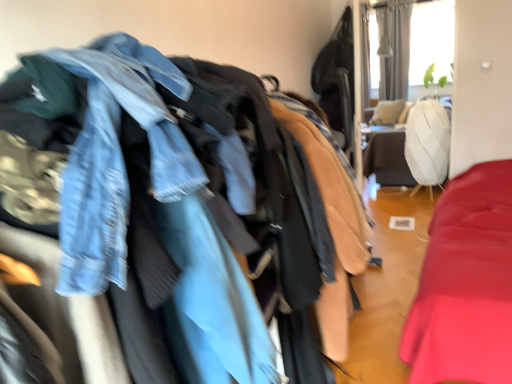
Identify the location of white textured curtain at upper right. Image resolution: width=512 pixels, height=384 pixels. [393, 48].

What do you see at coordinates (393, 48) in the screenshot? The width and height of the screenshot is (512, 384). I see `white textured curtain at upper right` at bounding box center [393, 48].

What do you see at coordinates (168, 207) in the screenshot? Image resolution: width=512 pixels, height=384 pixels. I see `faded denim jacket at upper left` at bounding box center [168, 207].

At what (x,y) coordinates should I click in order to perform the action: click on faded denim jacket at upper left. Please return your answer as a coordinate pair (x, y). Image resolution: width=512 pixels, height=384 pixels. Looking at the image, I should click on (168, 207).

What are the coordinates of `white textured curtain at upper right` in the screenshot? It's located at (393, 48).

Considering the relative positions of faded denim jacket at upper left and white textured curtain at upper right in the image provided, is faded denim jacket at upper left to the left or to the right of white textured curtain at upper right?

Based on their positions, faded denim jacket at upper left is located to the left of white textured curtain at upper right.

Between faded denim jacket at upper left and white textured curtain at upper right, which one is positioned behind?

white textured curtain at upper right is further from the camera.

Is point (275, 379) closer to viewer compared to point (400, 42)?

Yes.

From the image's perspective, who appears lower, faded denim jacket at upper left or white textured curtain at upper right?

faded denim jacket at upper left.

From a real-world perspective, between faded denim jacket at upper left and white textured curtain at upper right, who is vertically lower?

faded denim jacket at upper left is physically lower.

Is faded denim jacket at upper left wider or thinner than white textured curtain at upper right?

In the image, faded denim jacket at upper left appears to be wider than white textured curtain at upper right.

Between faded denim jacket at upper left and white textured curtain at upper right, which one has more height?

white textured curtain at upper right.

Can you confirm if faded denim jacket at upper left is bigger than white textured curtain at upper right?

Yes, faded denim jacket at upper left is bigger than white textured curtain at upper right.

Is faded denim jacket at upper left not within white textured curtain at upper right?

Yes, faded denim jacket at upper left is not within white textured curtain at upper right.

Are faded denim jacket at upper left and white textured curtain at upper right located far from each other?

Yes.

Is faded denim jacket at upper left looking in the opposite direction of white textured curtain at upper right?

No, faded denim jacket at upper left is not facing away from white textured curtain at upper right.

Can you tell me how much faded denim jacket at upper left and white textured curtain at upper right differ in facing direction?

87.2 degrees separate the facing orientations of faded denim jacket at upper left and white textured curtain at upper right.

Where is `jacket on the left side of white textured curtain at upper right`? jacket on the left side of white textured curtain at upper right is located at coordinates (168, 207).

Consider the image. Can you confirm if white textured curtain at upper right is positioned to the right of faded denim jacket at upper left?

Indeed, white textured curtain at upper right is positioned on the right side of faded denim jacket at upper left.

Which is behind, white textured curtain at upper right or faded denim jacket at upper left?

white textured curtain at upper right is further from the camera.

Does point (390, 95) come closer to viewer compared to point (288, 261)?

That is False.

From the image's perspective, does white textured curtain at upper right appear higher than faded denim jacket at upper left?

Yes, from the image's perspective, white textured curtain at upper right is above faded denim jacket at upper left.

From a real-world perspective, who is located higher, white textured curtain at upper right or faded denim jacket at upper left?

white textured curtain at upper right is physically above.

Can you confirm if white textured curtain at upper right is wider than faded denim jacket at upper left?

In fact, white textured curtain at upper right might be narrower than faded denim jacket at upper left.

Who is taller, white textured curtain at upper right or faded denim jacket at upper left?

Standing taller between the two is white textured curtain at upper right.

Who is smaller, white textured curtain at upper right or faded denim jacket at upper left?

white textured curtain at upper right.

Is white textured curtain at upper right situated inside faded denim jacket at upper left or outside?

white textured curtain at upper right is outside faded denim jacket at upper left.

Is white textured curtain at upper right positioned far away from faded denim jacket at upper left?

white textured curtain at upper right is far away from faded denim jacket at upper left.

Is white textured curtain at upper right looking in the opposite direction of faded denim jacket at upper left?

No.

The image size is (512, 384). There is a faded denim jacket at upper left. In order to click on curtain above it (from a real-world perspective) in this screenshot , I will do `click(393, 48)`.

This screenshot has height=384, width=512. In order to click on curtain on the right of faded denim jacket at upper left in this screenshot , I will do `click(393, 48)`.

At what (x,y) coordinates should I click in order to perform the action: click on jacket in front of the white textured curtain at upper right. Please return your answer as a coordinate pair (x, y). This screenshot has width=512, height=384. Looking at the image, I should click on (168, 207).